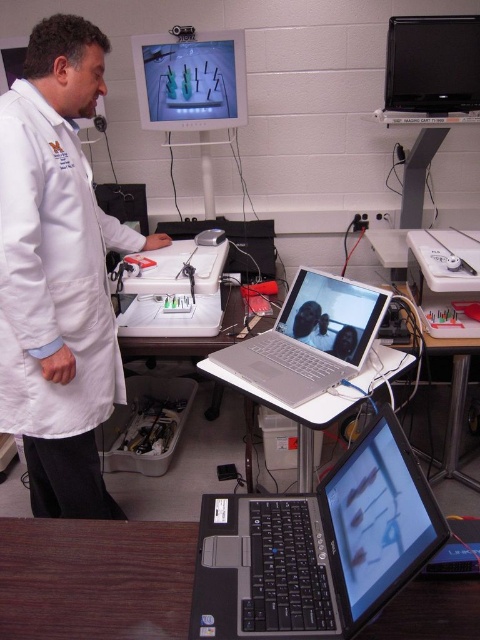
Where is `white lab coat at center`? white lab coat at center is located at coordinates (58, 273).

Between white lab coat at center and wooden table at lower left, which one has less height?

With less height is wooden table at lower left.

Where is `white lab coat at center`? This screenshot has height=640, width=480. white lab coat at center is located at coordinates (58, 273).

Who is more distant from viewer, (76,52) or (323,291)?

The point (323,291) is behind.

Does point (67, 241) come closer to viewer compared to point (266, 371)?

No, (67, 241) is further to viewer.

Is point (96, 212) positioned after point (336, 282)?

That is True.

Locate an element on the screen. white lab coat at center is located at coordinates (58, 273).

Can you confirm if black matte laptop at lower center is shorter than wooden table at lower left?

In fact, black matte laptop at lower center may be taller than wooden table at lower left.

Who is more forward, (208, 595) or (54, 525)?

Point (208, 595) is more forward.

Who is more forward, (233, 572) or (144, 580)?

Point (233, 572)

At what (x,y) coordinates should I click in order to perform the action: click on black matte laptop at lower center. Please return your answer as a coordinate pair (x, y). The height and width of the screenshot is (640, 480). Looking at the image, I should click on (316, 547).